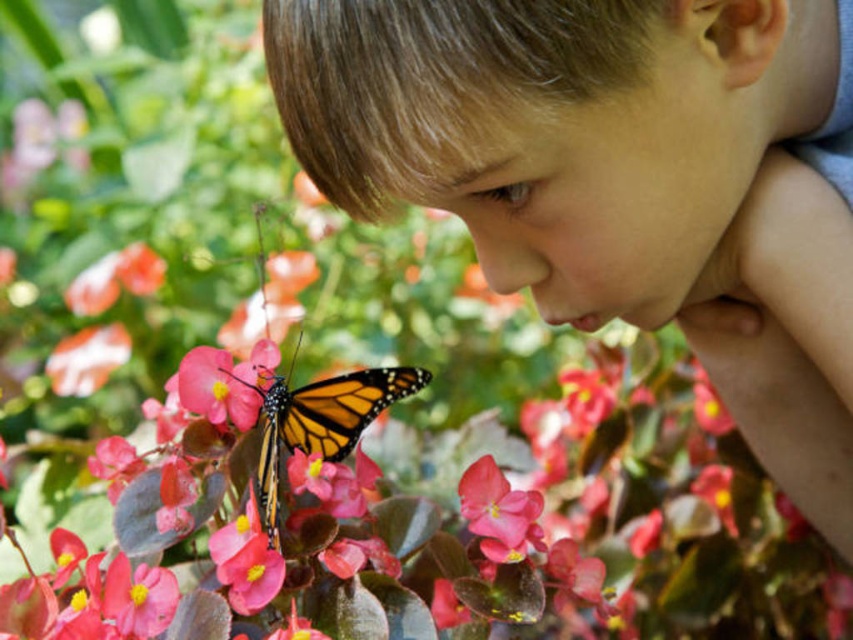
Looking at the scene where a young boy is observing a monarch butterfly on pink flowers, can you tell me which object is bigger between the orange and black spotted wings at center and the pink matte flower at center?

The orange and black spotted wings at center is larger in size than the pink matte flower at center.

Based on the scene description, where is the smooth skin child at center relative to the smooth pink petal at center?

The smooth skin child at center is to the right of the smooth pink petal at center.

The scene shows a young boy observing a monarch butterfly on two different types of pink petals. Which of the two petals, the smooth pink petal at center or the matte pink petal at center, takes up more space in the image?

The matte pink petal at center occupies more space than the smooth pink petal at center.